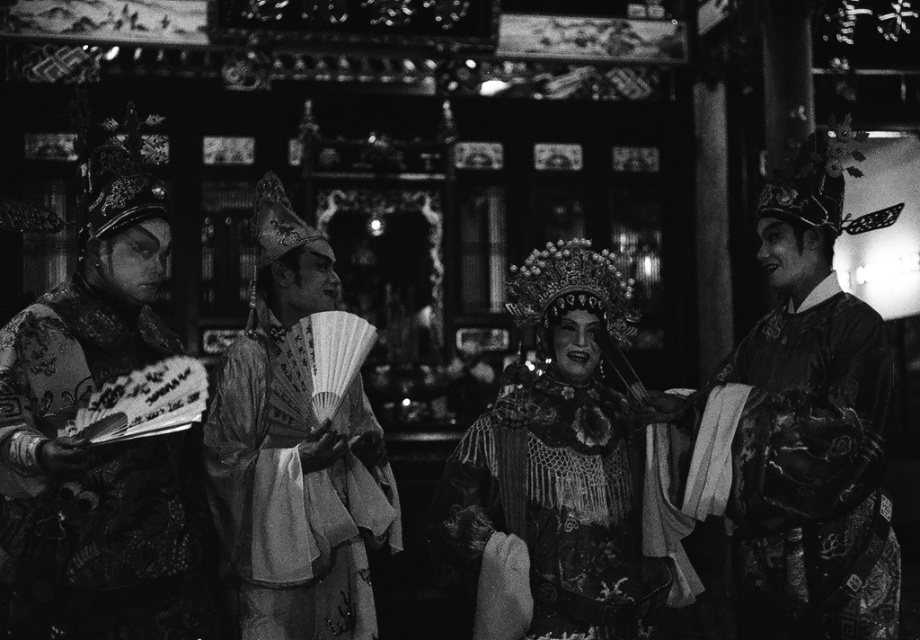
You are standing at the point labeled point (765, 356). You want to walk to the nearest exit, which is located at the far end of the stage. Considering the distance between you and the exit is 66.37 meters, can you estimate how long it would take you to walk there at a normal pace?

At a normal walking pace of approximately 1.4 meters per second, it would take about 47.4 seconds to cover the 66.37 meters distance from point (765, 356) to the exit.

You are an assistant at a cultural event and need to arrange these items on a shelf. The shelf has limited vertical space. Given that the matte black fan at left and the matte ornate headdress at center are to be placed on the same shelf, which item requires more vertical space due to its height?

The matte black fan at left requires more vertical space because it has a greater height compared to the matte ornate headdress at center.